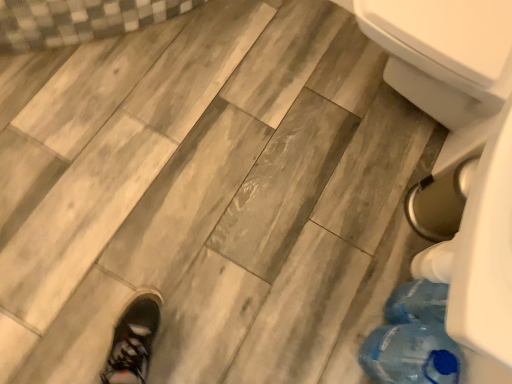
Question: Can you confirm if white plastic bidet at lower right is shorter than transparent plastic bottle at lower right?

Choices:
 (A) no
 (B) yes

Answer: (A)

Question: Is white plastic bidet at lower right facing away from transparent plastic bottle at lower right?

Choices:
 (A) no
 (B) yes

Answer: (A)

Question: Can you confirm if white plastic bidet at lower right is bigger than transparent plastic bottle at lower right?

Choices:
 (A) yes
 (B) no

Answer: (A)

Question: Is white plastic bidet at lower right completely or partially outside of transparent plastic bottle at lower right?

Choices:
 (A) no
 (B) yes

Answer: (B)

Question: From the image's perspective, is white plastic bidet at lower right above transparent plastic bottle at lower right?

Choices:
 (A) no
 (B) yes

Answer: (B)

Question: Does white plastic bidet at lower right turn towards transparent plastic bottle at lower right?

Choices:
 (A) yes
 (B) no

Answer: (B)

Question: Is transparent plastic bottle at lower right in front of white plastic bidet at lower right?

Choices:
 (A) yes
 (B) no

Answer: (A)

Question: Is transparent plastic bottle at lower right oriented away from white plastic bidet at lower right?

Choices:
 (A) no
 (B) yes

Answer: (A)

Question: Is transparent plastic bottle at lower right with white plastic bidet at lower right?

Choices:
 (A) no
 (B) yes

Answer: (A)

Question: Considering the relative sizes of transparent plastic bottle at lower right and white plastic bidet at lower right in the image provided, is transparent plastic bottle at lower right smaller than white plastic bidet at lower right?

Choices:
 (A) yes
 (B) no

Answer: (A)

Question: From the image's perspective, is transparent plastic bottle at lower right above white plastic bidet at lower right?

Choices:
 (A) yes
 (B) no

Answer: (B)

Question: Is transparent plastic bottle at lower right shorter than white plastic bidet at lower right?

Choices:
 (A) no
 (B) yes

Answer: (B)

Question: From a real-world perspective, relative to white plastic bidet at lower right, is transparent plastic bottle at lower right vertically above or below?

Choices:
 (A) below
 (B) above

Answer: (A)